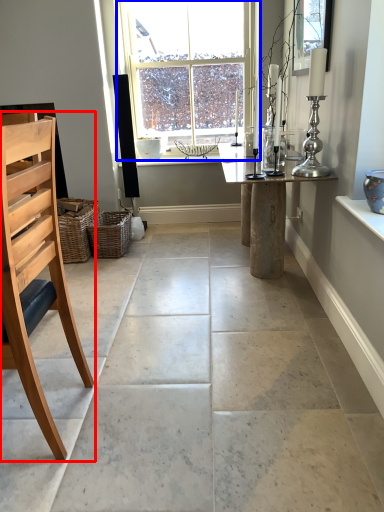
Question: Which of the following is the closest to the observer, chair (highlighted by a red box) or window (highlighted by a blue box)?

Choices:
 (A) chair
 (B) window

Answer: (A)